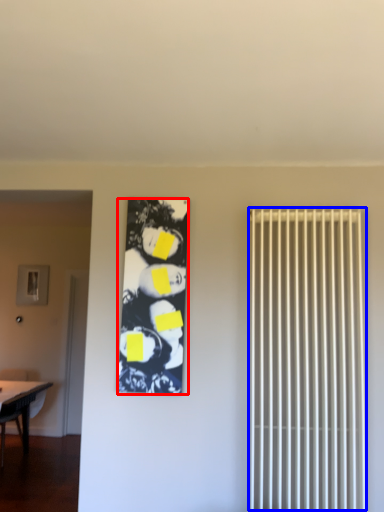
Question: Among these objects, which one is nearest to the camera, couple (highlighted by a red box) or radiator (highlighted by a blue box)?

Choices:
 (A) couple
 (B) radiator

Answer: (B)